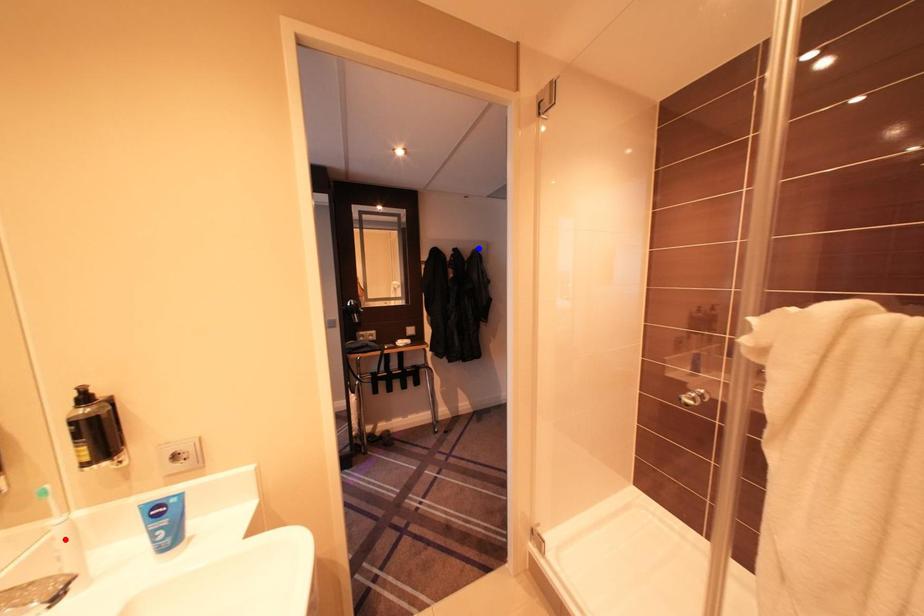
Question: Which of the two points in the image is closer to the camera?

Choices:
 (A) Blue point is closer.
 (B) Red point is closer.

Answer: (B)